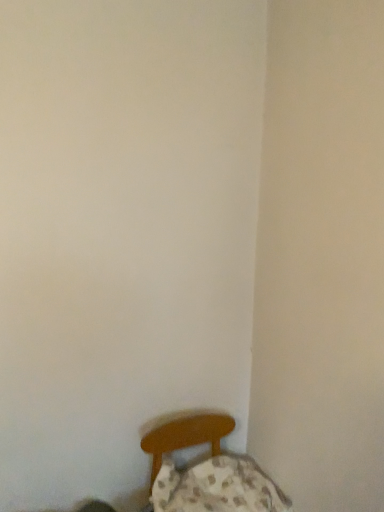
What do you see at coordinates (211, 461) in the screenshot?
I see `wooden chair at lower right` at bounding box center [211, 461].

The image size is (384, 512). Identify the location of wooden chair at lower right. (211, 461).

Find the location of a particular element. The height and width of the screenshot is (512, 384). wooden chair at lower right is located at coordinates (211, 461).